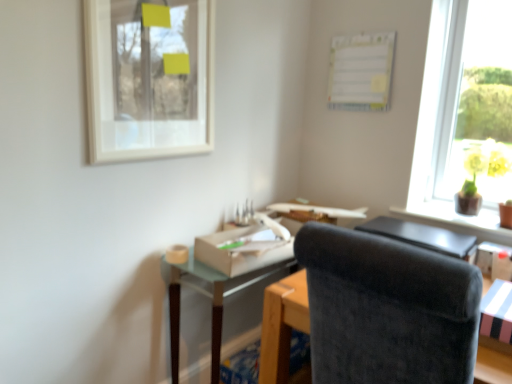
The width and height of the screenshot is (512, 384). Describe the element at coordinates (242, 250) in the screenshot. I see `white cardboard box at center, placed as the 2th cardboard box when sorted from front to back` at that location.

What is the approximate width of matte cardboard box at center, arranged as the 2th table when viewed from the right?

matte cardboard box at center, arranged as the 2th table when viewed from the right, is 13.83 inches wide.

Identify the location of matte cardboard box at center, arranged as the 2th table when viewed from the right. The height and width of the screenshot is (384, 512). (214, 295).

This screenshot has width=512, height=384. What do you see at coordinates (424, 237) in the screenshot? I see `black leather table at right, which is the first table in right-to-left order` at bounding box center [424, 237].

What do you see at coordinates (361, 71) in the screenshot? Image resolution: width=512 pixels, height=384 pixels. I see `white paperboard at upper center` at bounding box center [361, 71].

The image size is (512, 384). I want to click on white paperboard at upper center, so click(361, 71).

Locate an element on the screen. Image resolution: width=512 pixels, height=384 pixels. velvet black chair at center is located at coordinates (387, 309).

Find the location of `white cardboard box at center, acting as the 2th cardboard box starting from the bottom`. white cardboard box at center, acting as the 2th cardboard box starting from the bottom is located at coordinates (242, 250).

In the scene shown: From a real-world perspective, is white cardboard box at center, arranged as the 1th cardboard box when viewed from the back, physically above white paperboard at upper center?

No.

Can white paperboard at upper center be found inside white cardboard box at center, which ranks as the 2th cardboard box in right-to-left order?

No, white paperboard at upper center is not inside white cardboard box at center, which ranks as the 2th cardboard box in right-to-left order.

In order to click on the 1st cardboard box positioned below the white paperboard at upper center (from a real-world perspective) in this screenshot , I will do `click(242, 250)`.

Looking at this image, considering the relative sizes of white cardboard box at center, placed as the 2th cardboard box when sorted from front to back, and white paperboard at upper center in the image provided, is white cardboard box at center, placed as the 2th cardboard box when sorted from front to back, wider than white paperboard at upper center?

Correct, the width of white cardboard box at center, placed as the 2th cardboard box when sorted from front to back, exceeds that of white paperboard at upper center.

Is matte cardboard box at center, arranged as the 2th table when viewed from the right, in front of or behind white paperboard at upper center in the image?

Clearly, matte cardboard box at center, arranged as the 2th table when viewed from the right, is in front of white paperboard at upper center.

From the image's perspective, relative to white paperboard at upper center, is matte cardboard box at center, the first table in the left-to-right sequence, above or below?

Based on their image positions, matte cardboard box at center, the first table in the left-to-right sequence, is located beneath white paperboard at upper center.

Can you confirm if matte cardboard box at center, the first table in the left-to-right sequence, is positioned to the right of white paperboard at upper center?

In fact, matte cardboard box at center, the first table in the left-to-right sequence, is to the left of white paperboard at upper center.

From a real-world perspective, is white cardboard box at lower right, which is the first cardboard box in bottom-to-top order, positioned above or below white cardboard box at center, arranged as the 1th cardboard box when viewed from the back?

white cardboard box at lower right, which is the first cardboard box in bottom-to-top order, is situated lower than white cardboard box at center, arranged as the 1th cardboard box when viewed from the back, in the real world.

Can you confirm if white cardboard box at lower right, which is the first cardboard box in front-to-back order, is bigger than white cardboard box at center, placed as the 2th cardboard box when sorted from front to back?

Actually, white cardboard box at lower right, which is the first cardboard box in front-to-back order, might be smaller than white cardboard box at center, placed as the 2th cardboard box when sorted from front to back.

Is point (481, 307) in front of point (226, 234)?

Yes, it is.

Considering the sizes of objects white cardboard box at lower right, which is the first cardboard box in front-to-back order, and white cardboard box at center, acting as the 2th cardboard box starting from the bottom, in the image provided, who is thinner, white cardboard box at lower right, which is the first cardboard box in front-to-back order, or white cardboard box at center, acting as the 2th cardboard box starting from the bottom,?

With smaller width is white cardboard box at center, acting as the 2th cardboard box starting from the bottom.

Measure the distance between matte cardboard box at center, arranged as the 2th table when viewed from the right, and white cardboard box at center, placed as the 2th cardboard box when sorted from front to back.

matte cardboard box at center, arranged as the 2th table when viewed from the right, and white cardboard box at center, placed as the 2th cardboard box when sorted from front to back, are 3.89 inches apart from each other.

Is point (184, 273) farther from camera compared to point (237, 260)?

Yes, point (184, 273) is farther from viewer.

Find the location of a particular element. The height and width of the screenshot is (384, 512). cardboard box on the left side of matte cardboard box at center, the first table in the left-to-right sequence is located at coordinates (242, 250).

Are matte cardboard box at center, the first table in the left-to-right sequence, and white cardboard box at center, placed as the 2th cardboard box when sorted from front to back, beside each other?

Yes, matte cardboard box at center, the first table in the left-to-right sequence, is right next to white cardboard box at center, placed as the 2th cardboard box when sorted from front to back, and making contact.

Can you confirm if white matte picture frame at upper left is positioned to the left of white paperboard at upper center?

Correct, you'll find white matte picture frame at upper left to the left of white paperboard at upper center.

From a real-world perspective, is white matte picture frame at upper left on white paperboard at upper center?

No.

Is there a large distance between white matte picture frame at upper left and white paperboard at upper center?

They are positioned close to each other.

How many degrees apart are the facing directions of white matte picture frame at upper left and white paperboard at upper center?

The angle between the facing direction of white matte picture frame at upper left and the facing direction of white paperboard at upper center is 89.8 degrees.

Locate an element on the screen. plant that is on the right side of white cardboard box at center, acting as the 2th cardboard box starting from the bottom is located at coordinates (486, 169).

In the scene shown: From the image's perspective, which is below, yellow glossy vase at upper right or white cardboard box at center, which is the first cardboard box from left to right?

white cardboard box at center, which is the first cardboard box from left to right.

How different are the orientations of yellow glossy vase at upper right and white cardboard box at center, arranged as the 1th cardboard box when viewed from the back, in degrees?

The facing directions of yellow glossy vase at upper right and white cardboard box at center, arranged as the 1th cardboard box when viewed from the back, are 2.68 degrees apart.

Is point (466, 157) behind point (203, 262)?

Yes.

Is white cardboard box at center, which ranks as the 2th cardboard box in right-to-left order, facing towards yellow glossy vase at upper right?

No, white cardboard box at center, which ranks as the 2th cardboard box in right-to-left order, is not oriented towards yellow glossy vase at upper right.

Is point (245, 260) closer or farther from the camera than point (466, 180)?

Point (245, 260) is closer to the camera than point (466, 180).

Looking at this image, from a real-world perspective, is white cardboard box at center, acting as the 2th cardboard box starting from the bottom, physically above yellow glossy vase at upper right?

No.

Is yellow glossy vase at upper right inside white cardboard box at center, which is the 1th cardboard box in top-to-bottom order?

No, yellow glossy vase at upper right is not inside white cardboard box at center, which is the 1th cardboard box in top-to-bottom order.

Image resolution: width=512 pixels, height=384 pixels. I want to click on bulletin board located above the white cardboard box at center, acting as the 2th cardboard box starting from the bottom (from the image's perspective), so click(x=361, y=71).

The height and width of the screenshot is (384, 512). What are the coordinates of `bulletin board that is behind the matte cardboard box at center, arranged as the 2th table when viewed from the right` in the screenshot? It's located at (361, 71).

Estimate the real-world distances between objects in this image. Which object is further from white paperboard at upper center, white matte picture frame at upper left or yellow glossy vase at upper right?

white matte picture frame at upper left is positioned further to the anchor white paperboard at upper center.

When comparing their distances from velvet black chair at center, does white cardboard box at lower right, which is the first cardboard box in bottom-to-top order, or black leather table at right, which is the first table in right-to-left order, seem further?

black leather table at right, which is the first table in right-to-left order.

Based on their spatial positions, is white paperboard at upper center or white matte picture frame at upper left closer to yellow glossy vase at upper right?

white paperboard at upper center.

From the picture: Considering their positions, is white matte picture frame at upper left positioned closer to white cardboard box at lower right, arranged as the 2th cardboard box when viewed from the left, than white cardboard box at center, which ranks as the 2th cardboard box in right-to-left order?

Based on the image, white cardboard box at center, which ranks as the 2th cardboard box in right-to-left order, appears to be nearer to white cardboard box at lower right, arranged as the 2th cardboard box when viewed from the left.

Which object lies nearer to the anchor point white cardboard box at center, which is the 1th cardboard box in top-to-bottom order, velvet black chair at center or white cardboard box at lower right, which is the first cardboard box in bottom-to-top order?

velvet black chair at center lies closer to white cardboard box at center, which is the 1th cardboard box in top-to-bottom order, than the other object.

Looking at the image, which one is located closer to yellow glossy vase at upper right, velvet black chair at center or matte cardboard box at center, arranged as the 2th table when viewed from the right?

Based on the image, matte cardboard box at center, arranged as the 2th table when viewed from the right, appears to be nearer to yellow glossy vase at upper right.

From the image, which object appears to be farther from velvet black chair at center, white paperboard at upper center or white cardboard box at center, placed as the 2th cardboard box when sorted from front to back?

white paperboard at upper center.

From the image, which object appears to be farther from matte cardboard box at center, the first table in the left-to-right sequence, white cardboard box at lower right, arranged as the 2th cardboard box when viewed from the left, or velvet black chair at center?

white cardboard box at lower right, arranged as the 2th cardboard box when viewed from the left.

This screenshot has width=512, height=384. I want to click on cardboard box located between white matte picture frame at upper left and black leather table at right, the 2th table when ordered from left to right, in the left-right direction, so click(242, 250).

This screenshot has height=384, width=512. Find the location of `table between white paperboard at upper center and matte cardboard box at center, the first table in the left-to-right sequence, vertically`. table between white paperboard at upper center and matte cardboard box at center, the first table in the left-to-right sequence, vertically is located at coordinates (424, 237).

What are the coordinates of `table between white matte picture frame at upper left and black leather table at right, the 2th table when ordered from left to right, from left to right` in the screenshot? It's located at (214, 295).

Image resolution: width=512 pixels, height=384 pixels. I want to click on cardboard box between white paperboard at upper center and white cardboard box at lower right, which is the first cardboard box in bottom-to-top order, vertically, so click(242, 250).